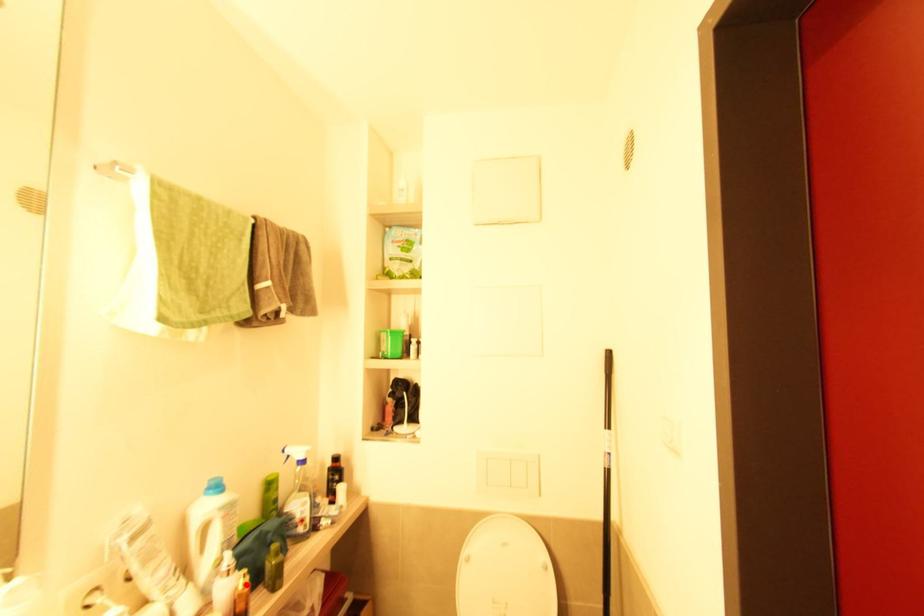
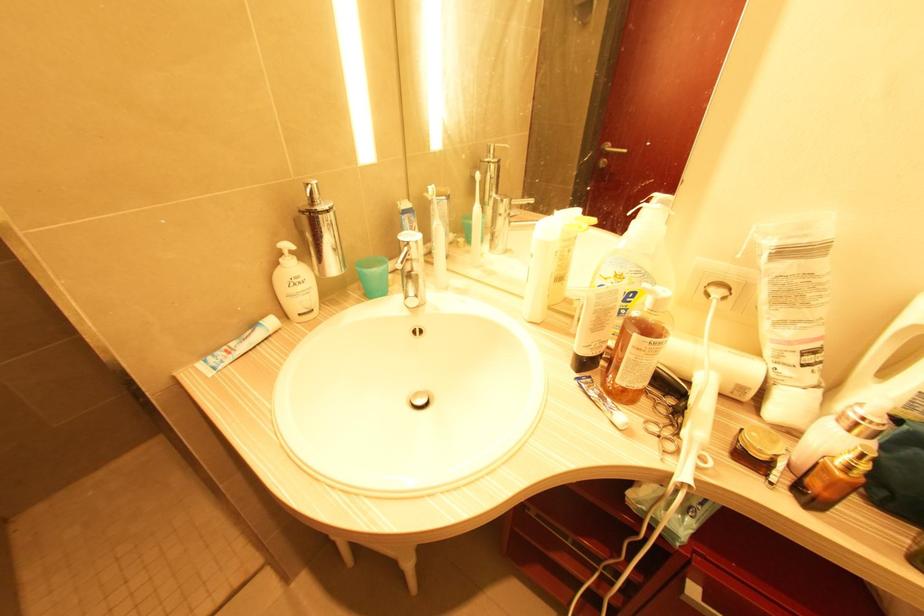
The point at the highlighted location is marked in the first image. Where is the corresponding point in the second image?

(850, 468)